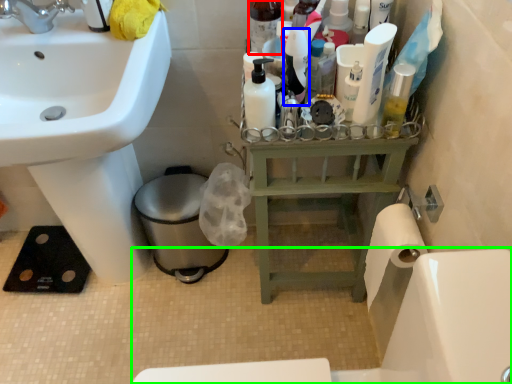
Question: Which object is positioned closest to toiletry (highlighted by a red box)? Select from toiletry (highlighted by a blue box) and bath (highlighted by a green box).

Choices:
 (A) toiletry
 (B) bath

Answer: (A)